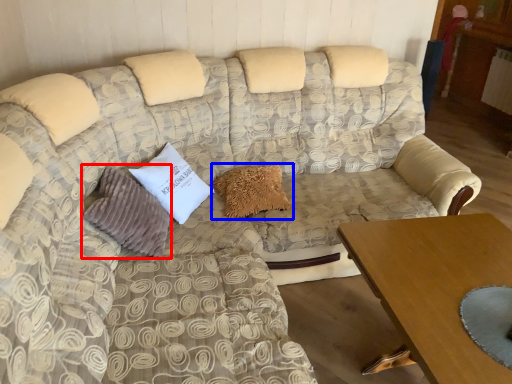
Question: Which object appears closest to the camera in this image, pillow (highlighted by a red box) or pillow (highlighted by a blue box)?

Choices:
 (A) pillow
 (B) pillow

Answer: (A)